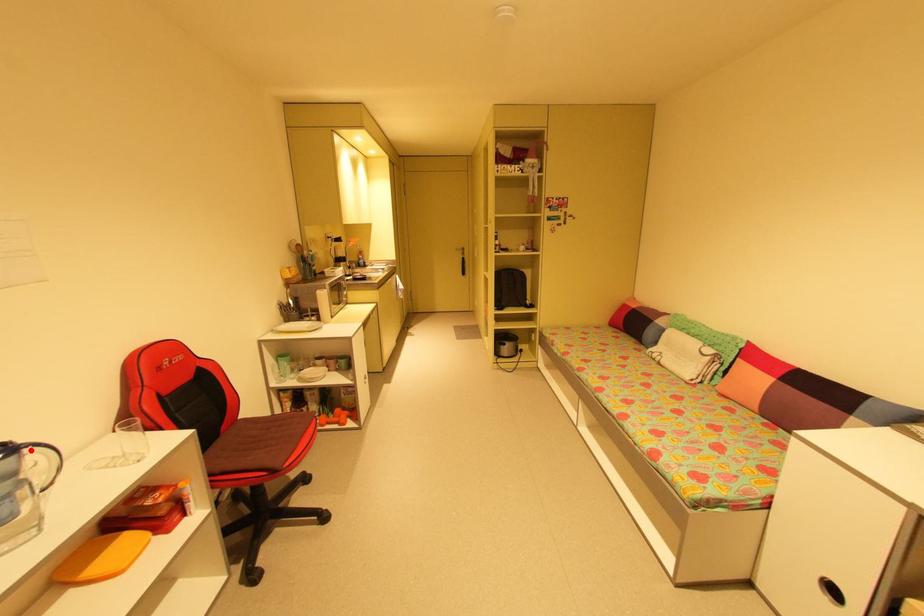
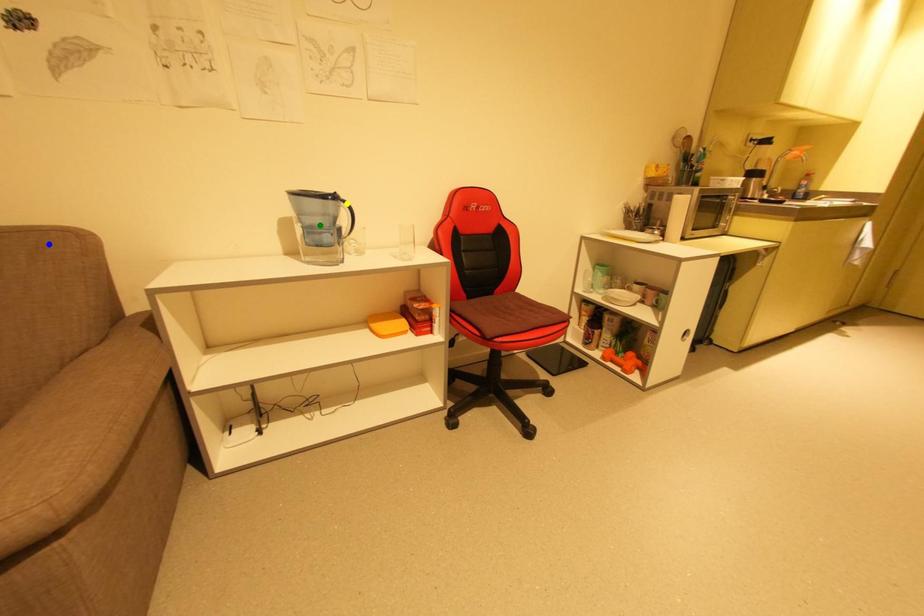
Question: I am providing you with two images of the same scene from different viewpoints. A red point is marked on the first image. You are given multiple points on the second image. Can you choose the point in image 2 that corresponds to the point in image 1?

Choices:
 (A) yellow point
 (B) blue point
 (C) green point

Answer: (A)